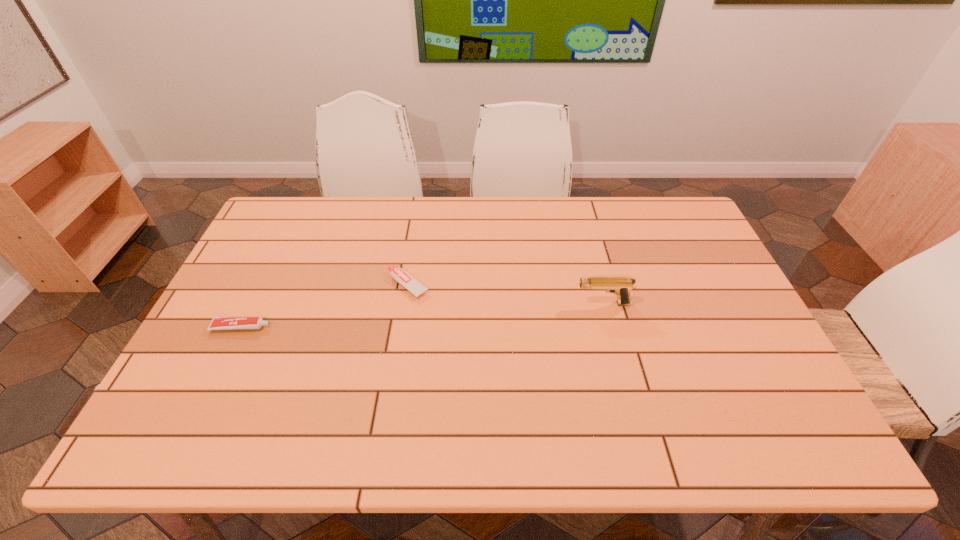
Where is `free location that satisfies the following two spatial constraints: 1. on the front side of the farther toothpaste; 2. at the nozzle of the leftmost object`? The width and height of the screenshot is (960, 540). free location that satisfies the following two spatial constraints: 1. on the front side of the farther toothpaste; 2. at the nozzle of the leftmost object is located at coordinates (401, 327).

This screenshot has height=540, width=960. What are the coordinates of `free space that satisfies the following two spatial constraints: 1. on the front side of the farther toothpaste; 2. at the nozzle of the nearest object` in the screenshot? It's located at (401, 327).